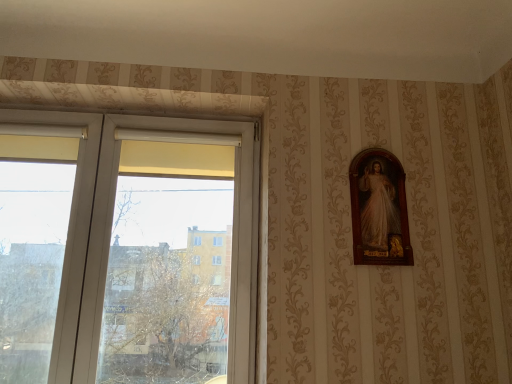
Question: Does wooden frame at right lie in front of transparent glass window at left?

Choices:
 (A) yes
 (B) no

Answer: (B)

Question: Does wooden frame at right have a greater height compared to transparent glass window at left?

Choices:
 (A) yes
 (B) no

Answer: (B)

Question: Is wooden frame at right facing towards transparent glass window at left?

Choices:
 (A) yes
 (B) no

Answer: (B)

Question: From the image's perspective, is wooden frame at right located above transparent glass window at left?

Choices:
 (A) yes
 (B) no

Answer: (A)

Question: Does wooden frame at right come behind transparent glass window at left?

Choices:
 (A) no
 (B) yes

Answer: (B)

Question: Is wooden frame at right facing away from transparent glass window at left?

Choices:
 (A) no
 (B) yes

Answer: (A)

Question: Is transparent glass window at left in contact with wooden frame at right?

Choices:
 (A) no
 (B) yes

Answer: (A)

Question: Is transparent glass window at left shorter than wooden frame at right?

Choices:
 (A) yes
 (B) no

Answer: (B)

Question: Considering the relative sizes of transparent glass window at left and wooden frame at right in the image provided, is transparent glass window at left bigger than wooden frame at right?

Choices:
 (A) no
 (B) yes

Answer: (B)

Question: Is transparent glass window at left looking in the opposite direction of wooden frame at right?

Choices:
 (A) no
 (B) yes

Answer: (A)

Question: Is the position of transparent glass window at left less distant than that of wooden frame at right?

Choices:
 (A) no
 (B) yes

Answer: (B)

Question: Is transparent glass window at left wider than wooden frame at right?

Choices:
 (A) no
 (B) yes

Answer: (B)

Question: Considering the positions of transparent glass window at left and wooden frame at right in the image, is transparent glass window at left wider or thinner than wooden frame at right?

Choices:
 (A) wide
 (B) thin

Answer: (A)